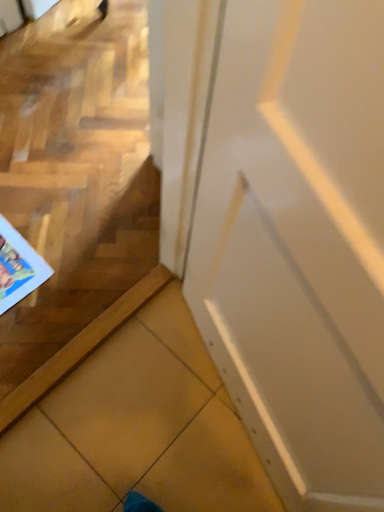
The width and height of the screenshot is (384, 512). In order to click on free region on the left part of white glossy door at center in this screenshot , I will do `click(128, 398)`.